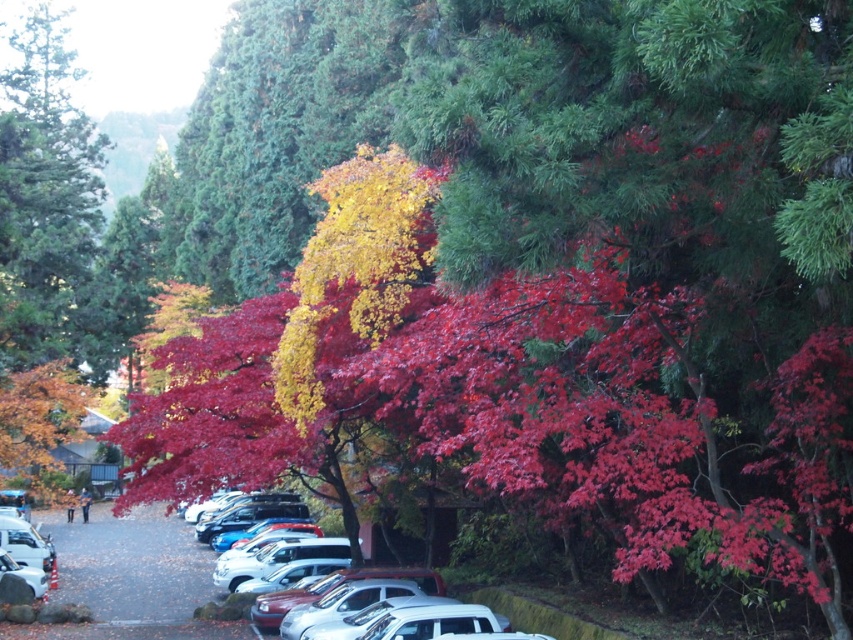
Question: Is green matte tree at upper left smaller than white glossy car at lower left?

Choices:
 (A) yes
 (B) no

Answer: (B)

Question: Is green matte tree at upper left below white matte car at center?

Choices:
 (A) yes
 (B) no

Answer: (B)

Question: Which point appears farthest from the camera in this image?

Choices:
 (A) (70, 241)
 (B) (367, 577)
 (C) (6, 509)

Answer: (A)

Question: Which object is closer to the camera taking this photo?

Choices:
 (A) green matte tree at upper left
 (B) white matte car at center

Answer: (B)

Question: Which object is positioned farthest from the green matte tree at upper left?

Choices:
 (A) white glossy car at lower left
 (B) white matte car at center

Answer: (B)

Question: Where is green matte tree at upper left located in relation to white glossy car at lower left in the image?

Choices:
 (A) above
 (B) below

Answer: (A)